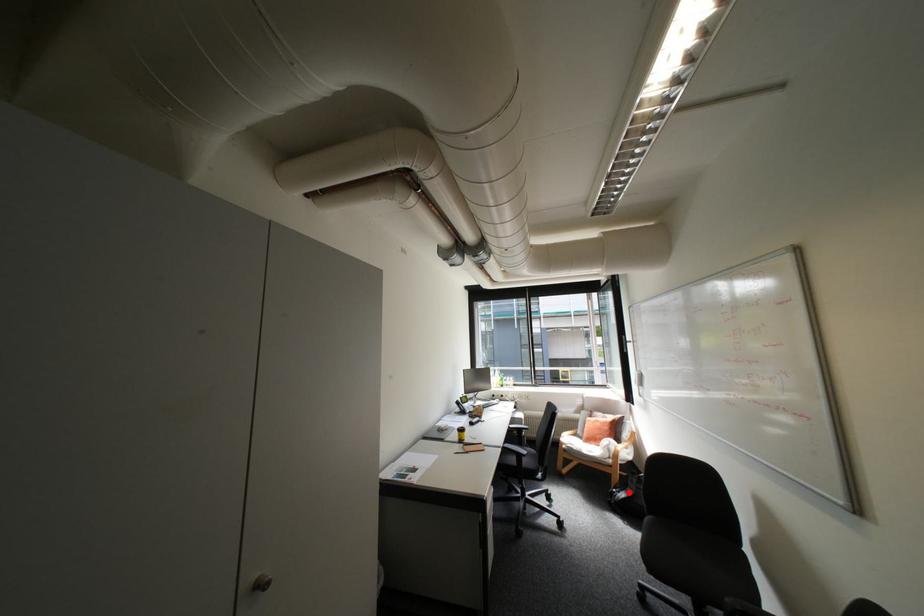
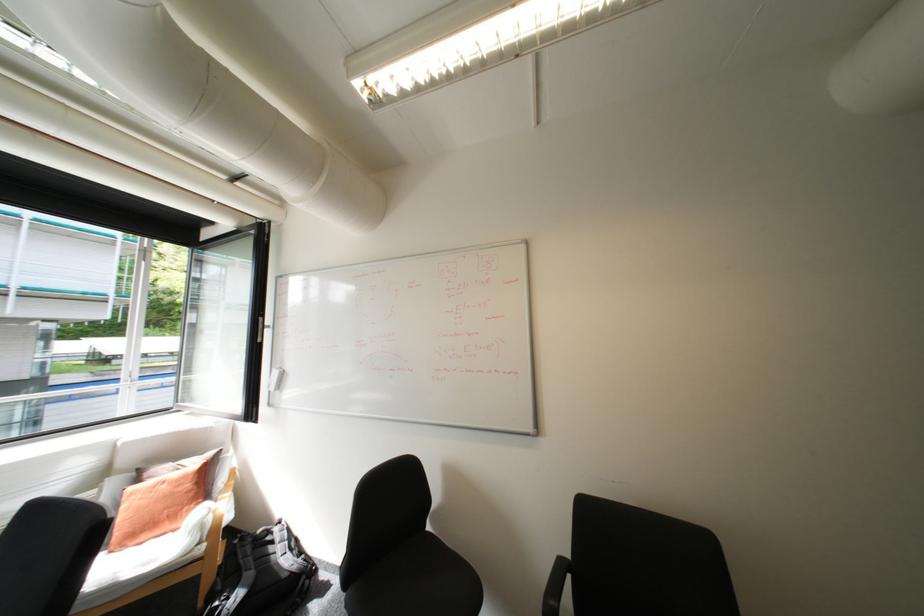
Question: A red point is marked in image1. In image2, is the corresponding 3D point closer to the camera or farther? Reply with the corresponding letter.

Choices:
 (A) The corresponding 3D point is closer.
 (B) The corresponding 3D point is farther.

Answer: (A)